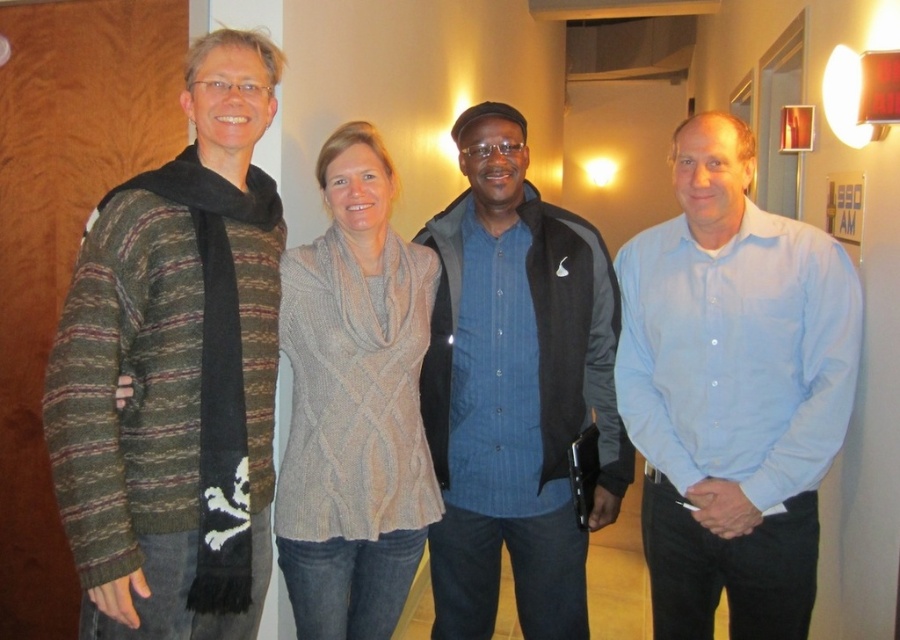
Question: Which point is closer to the camera taking this photo?

Choices:
 (A) (x=456, y=540)
 (B) (x=718, y=397)

Answer: (B)

Question: Can you confirm if knitted wool sweater at left is positioned to the right of knitted gray scarf at center?

Choices:
 (A) yes
 (B) no

Answer: (B)

Question: Which of these objects is positioned closest to the blue button-up shirt at center?

Choices:
 (A) knitted wool sweater at left
 (B) knitted gray scarf at center

Answer: (B)

Question: Considering the real-world distances, which object is closest to the knitted gray scarf at center?

Choices:
 (A) blue button-up shirt at center
 (B) knitted wool sweater at left

Answer: (A)

Question: Does knitted wool sweater at left have a lesser width compared to light blue shirt at right?

Choices:
 (A) no
 (B) yes

Answer: (B)

Question: Can you confirm if knitted wool sweater at left is smaller than light blue shirt at right?

Choices:
 (A) yes
 (B) no

Answer: (A)